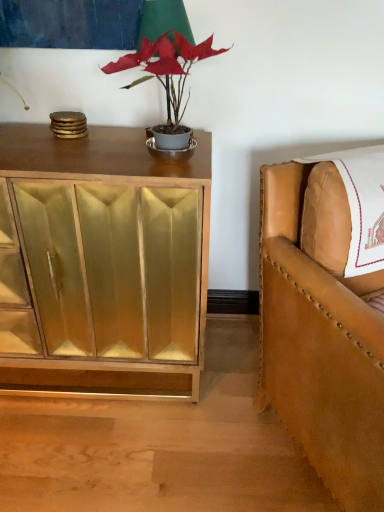
Where is `green fabric table lamp at upper center`? green fabric table lamp at upper center is located at coordinates (164, 21).

Measure the distance between point [166,132] and camera.

Point [166,132] is 1.01 meters from camera.

What do you see at coordinates (321, 331) in the screenshot? I see `tan leather chair at right` at bounding box center [321, 331].

You are a GUI agent. You are given a task and a screenshot of the screen. Output one action in this format:
    pyautogui.click(x=<x>, y=<y>)
    Task: Click on the gold mirrored cabinet at left
    This screenshot has width=384, height=512.
    Given the screenshot: What is the action you would take?
    pyautogui.click(x=101, y=264)

This screenshot has height=512, width=384. I want to click on green fabric table lamp at upper center, so click(164, 21).

Does green fabric table lamp at upper center have a lesser height compared to gold mirrored cabinet at left?

Correct, green fabric table lamp at upper center is not as tall as gold mirrored cabinet at left.

How different are the orientations of green fabric table lamp at upper center and gold mirrored cabinet at left in degrees?

1.07 degrees separate the facing orientations of green fabric table lamp at upper center and gold mirrored cabinet at left.

Would you say green fabric table lamp at upper center is a long distance from gold mirrored cabinet at left?

Actually, green fabric table lamp at upper center and gold mirrored cabinet at left are a little close together.

Is gold mirrored cabinet at left surrounded by green fabric table lamp at upper center?

Definitely not — gold mirrored cabinet at left is not inside green fabric table lamp at upper center.

Is tan leather chair at right looking in the opposite direction of gold mirrored cabinet at left?

No.

Is point (383, 408) less distant than point (56, 249)?

Yes, it is in front of point (56, 249).

In the scene shown: Looking at their sizes, would you say tan leather chair at right is wider or thinner than gold mirrored cabinet at left?

tan leather chair at right is wider than gold mirrored cabinet at left.

Is tan leather chair at right directly adjacent to gold mirrored cabinet at left?

tan leather chair at right and gold mirrored cabinet at left are not in contact.

Visually, is matte gray pot at center positioned to the left or to the right of green fabric table lamp at upper center?

matte gray pot at center is to the right of green fabric table lamp at upper center.

From a real-world perspective, is matte gray pot at center physically located above or below green fabric table lamp at upper center?

From a real-world perspective, matte gray pot at center is physically below green fabric table lamp at upper center.

At what (x,y) coordinates should I click in order to perform the action: click on table lamp on the left of matte gray pot at center. Please return your answer as a coordinate pair (x, y). This screenshot has height=512, width=384. Looking at the image, I should click on [x=164, y=21].

Is matte gray pot at center completely or partially outside of green fabric table lamp at upper center?

Yes, matte gray pot at center is outside of green fabric table lamp at upper center.

Considering the relative sizes of green fabric table lamp at upper center and matte gray pot at center in the image provided, is green fabric table lamp at upper center bigger than matte gray pot at center?

Actually, green fabric table lamp at upper center might be smaller than matte gray pot at center.

Would you say green fabric table lamp at upper center is a long distance from matte gray pot at center?

green fabric table lamp at upper center is actually quite close to matte gray pot at center.

From the image's perspective, which one is positioned higher, green fabric table lamp at upper center or matte gray pot at center?

green fabric table lamp at upper center, from the image's perspective.

Is tan leather chair at right directly adjacent to matte gray pot at center?

tan leather chair at right is not next to matte gray pot at center, and they're not touching.

From a real-world perspective, relative to matte gray pot at center, is tan leather chair at right vertically above or below?

tan leather chair at right is situated lower than matte gray pot at center in the real world.

Could you tell me if tan leather chair at right is facing matte gray pot at center?

No, tan leather chair at right is not facing towards matte gray pot at center.

Is tan leather chair at right not within matte gray pot at center?

Indeed, tan leather chair at right is completely outside matte gray pot at center.

How different are the orientations of matte gray pot at center and gold mirrored cabinet at left in degrees?

The angular difference between matte gray pot at center and gold mirrored cabinet at left is 0.217 degrees.

Based on the photo, is matte gray pot at center positioned far away from gold mirrored cabinet at left?

No, matte gray pot at center is not far away from gold mirrored cabinet at left.

Based on the photo, from a real-world perspective, is matte gray pot at center on gold mirrored cabinet at left?

Yes, from a real-world perspective, matte gray pot at center is over gold mirrored cabinet at left

Considering the relative sizes of matte gray pot at center and gold mirrored cabinet at left in the image provided, is matte gray pot at center bigger than gold mirrored cabinet at left?

Incorrect, matte gray pot at center is not larger than gold mirrored cabinet at left.

From the picture: Considering the relative sizes of gold mirrored cabinet at left and green fabric table lamp at upper center in the image provided, is gold mirrored cabinet at left wider than green fabric table lamp at upper center?

Correct, the width of gold mirrored cabinet at left exceeds that of green fabric table lamp at upper center.

Who is smaller, gold mirrored cabinet at left or green fabric table lamp at upper center?

With smaller size is green fabric table lamp at upper center.

From a real-world perspective, is gold mirrored cabinet at left physically above green fabric table lamp at upper center?

Actually, gold mirrored cabinet at left is physically below green fabric table lamp at upper center in the real world.

From the image's perspective, between gold mirrored cabinet at left and green fabric table lamp at upper center, who is located below?

gold mirrored cabinet at left appears lower in the image.

The height and width of the screenshot is (512, 384). What are the coordinates of `cabinetry in front of the green fabric table lamp at upper center` in the screenshot? It's located at (101, 264).

Identify the location of chair located on the right of gold mirrored cabinet at left. (321, 331).

When comparing their distances from green fabric table lamp at upper center, does matte gray pot at center or tan leather chair at right seem further?

tan leather chair at right is positioned further to the anchor green fabric table lamp at upper center.

Estimate the real-world distances between objects in this image. Which object is closer to gold mirrored cabinet at left, matte gray pot at center or tan leather chair at right?

tan leather chair at right is positioned closer to the anchor gold mirrored cabinet at left.

When comparing their distances from green fabric table lamp at upper center, does gold mirrored cabinet at left or tan leather chair at right seem further?

tan leather chair at right is positioned further to the anchor green fabric table lamp at upper center.

Considering their positions, is matte gray pot at center positioned further to green fabric table lamp at upper center than gold mirrored cabinet at left?

The object further to green fabric table lamp at upper center is gold mirrored cabinet at left.

From the image, which object appears to be nearer to matte gray pot at center, tan leather chair at right or gold mirrored cabinet at left?

Among the two, gold mirrored cabinet at left is located nearer to matte gray pot at center.

Considering their positions, is gold mirrored cabinet at left positioned further to green fabric table lamp at upper center than matte gray pot at center?

gold mirrored cabinet at left is further to green fabric table lamp at upper center.

Based on their spatial positions, is tan leather chair at right or gold mirrored cabinet at left further from green fabric table lamp at upper center?

The object further to green fabric table lamp at upper center is tan leather chair at right.

When comparing their distances from tan leather chair at right, does matte gray pot at center or gold mirrored cabinet at left seem further?

matte gray pot at center is positioned further to the anchor tan leather chair at right.

Where is `houseplant between green fabric table lamp at upper center and gold mirrored cabinet at left in the up-down direction`? The image size is (384, 512). houseplant between green fabric table lamp at upper center and gold mirrored cabinet at left in the up-down direction is located at coordinates click(x=166, y=67).

Identify the location of houseplant between green fabric table lamp at upper center and tan leather chair at right in the horizontal direction. This screenshot has width=384, height=512. (166, 67).

What are the coordinates of `table lamp between gold mirrored cabinet at left and tan leather chair at right in the horizontal direction` in the screenshot? It's located at (164, 21).

At what (x,y) coordinates should I click in order to perform the action: click on houseplant between gold mirrored cabinet at left and tan leather chair at right. Please return your answer as a coordinate pair (x, y). This screenshot has height=512, width=384. Looking at the image, I should click on (166, 67).